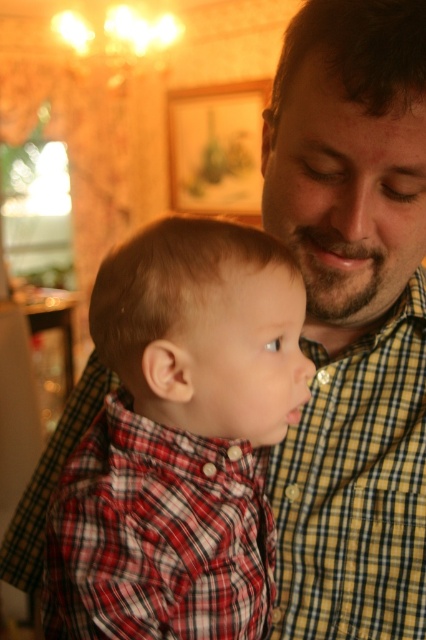
Question: Which point appears farthest from the camera in this image?

Choices:
 (A) coord(362,538)
 (B) coord(232,563)

Answer: (A)

Question: Does red plaid shirt at center have a lesser width compared to yellow checkered shirt at center?

Choices:
 (A) no
 (B) yes

Answer: (A)

Question: Which object appears closest to the camera in this image?

Choices:
 (A) yellow checkered shirt at center
 (B) red plaid shirt at center

Answer: (B)

Question: Is red plaid shirt at center below yellow checkered shirt at center?

Choices:
 (A) yes
 (B) no

Answer: (B)

Question: In this image, where is red plaid shirt at center located relative to yellow checkered shirt at center?

Choices:
 (A) right
 (B) left

Answer: (B)